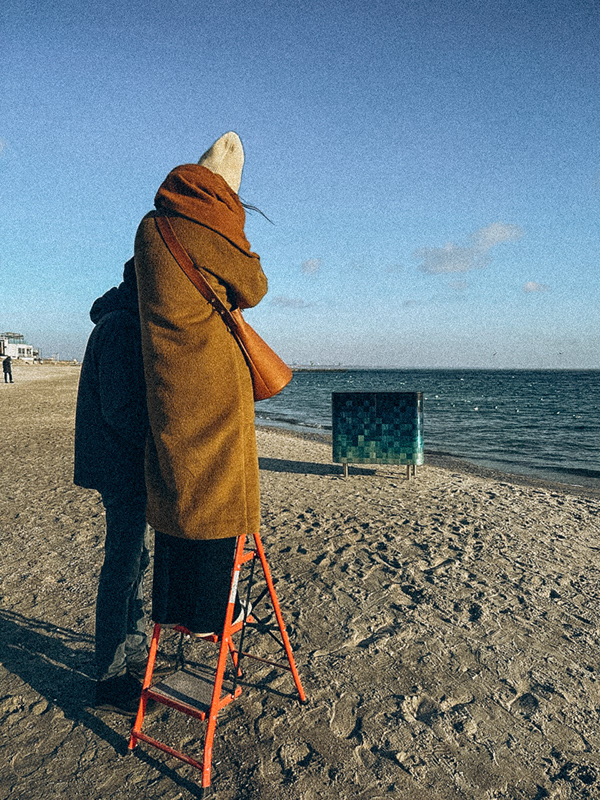
Find the location of a particular element. This screenshot has height=800, width=600. step stool is located at coordinates (217, 681).